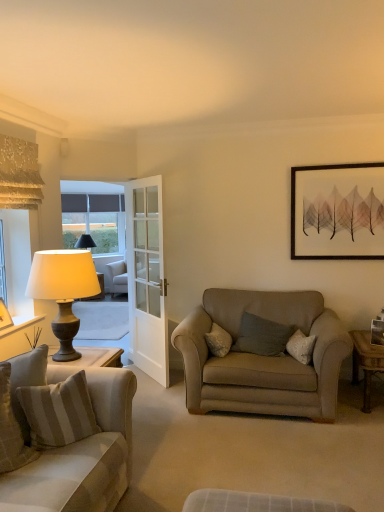
Question: Is soft gray cushion at center, the first pillow viewed from the right, wider than beige fabric couch at left?

Choices:
 (A) yes
 (B) no

Answer: (B)

Question: Is soft gray cushion at center, the 3th pillow when ordered from front to back, aimed at beige fabric couch at left?

Choices:
 (A) no
 (B) yes

Answer: (B)

Question: Is soft gray cushion at center, the 3th pillow when ordered from front to back, behind beige fabric couch at left?

Choices:
 (A) no
 (B) yes

Answer: (B)

Question: Is soft gray cushion at center, the first pillow viewed from the right, next to beige fabric couch at left?

Choices:
 (A) yes
 (B) no

Answer: (B)

Question: Does soft gray cushion at center, the 3th pillow positioned from the left, come in front of beige fabric couch at left?

Choices:
 (A) no
 (B) yes

Answer: (A)

Question: Is soft gray cushion at center, the 3th pillow when ordered from front to back, to the left of beige fabric couch at left from the viewer's perspective?

Choices:
 (A) no
 (B) yes

Answer: (A)

Question: Does matte gray lamp at left appear on the left side of wooden picture frame at right, the 3th picture frame from the left?

Choices:
 (A) yes
 (B) no

Answer: (A)

Question: Is matte gray lamp at left turned away from wooden picture frame at right, which appears as the second picture frame when viewed from the back?

Choices:
 (A) no
 (B) yes

Answer: (A)

Question: Is matte gray lamp at left facing towards wooden picture frame at right, which is counted as the third picture frame, starting from the top?

Choices:
 (A) yes
 (B) no

Answer: (A)

Question: Is matte gray lamp at left thinner than wooden picture frame at right, positioned as the 2th picture frame in front-to-back order?

Choices:
 (A) no
 (B) yes

Answer: (A)

Question: Is matte gray lamp at left at the right side of wooden picture frame at right, which ranks as the 1th picture frame in bottom-to-top order?

Choices:
 (A) yes
 (B) no

Answer: (B)

Question: From a real-world perspective, is matte gray lamp at left under wooden picture frame at right, which ranks as the 1th picture frame in bottom-to-top order?

Choices:
 (A) yes
 (B) no

Answer: (B)

Question: Can you confirm if striped fabric pillow at lower left, acting as the 3th pillow starting from the back, is shorter than wooden desk at right?

Choices:
 (A) yes
 (B) no

Answer: (B)